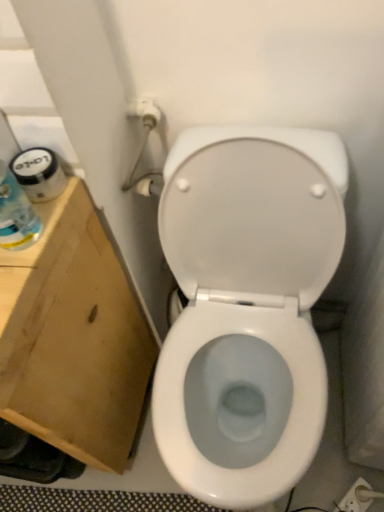
Question: Considering the positions of brown cardboard at left and white plastic electric outlet at lower right in the image, is brown cardboard at left wider or thinner than white plastic electric outlet at lower right?

Choices:
 (A) wide
 (B) thin

Answer: (A)

Question: From the image's perspective, is brown cardboard at left positioned above or below white plastic electric outlet at lower right?

Choices:
 (A) below
 (B) above

Answer: (B)

Question: Estimate the real-world distances between objects in this image. Which object is farther from the white glossy toilet at center?

Choices:
 (A) translucent plastic bottle at left
 (B) white plastic electric outlet at lower right
 (C) brown cardboard at left

Answer: (B)

Question: Estimate the real-world distances between objects in this image. Which object is closer to the translucent plastic bottle at left?

Choices:
 (A) white plastic electric outlet at lower right
 (B) brown cardboard at left
 (C) white glossy toilet at center

Answer: (B)